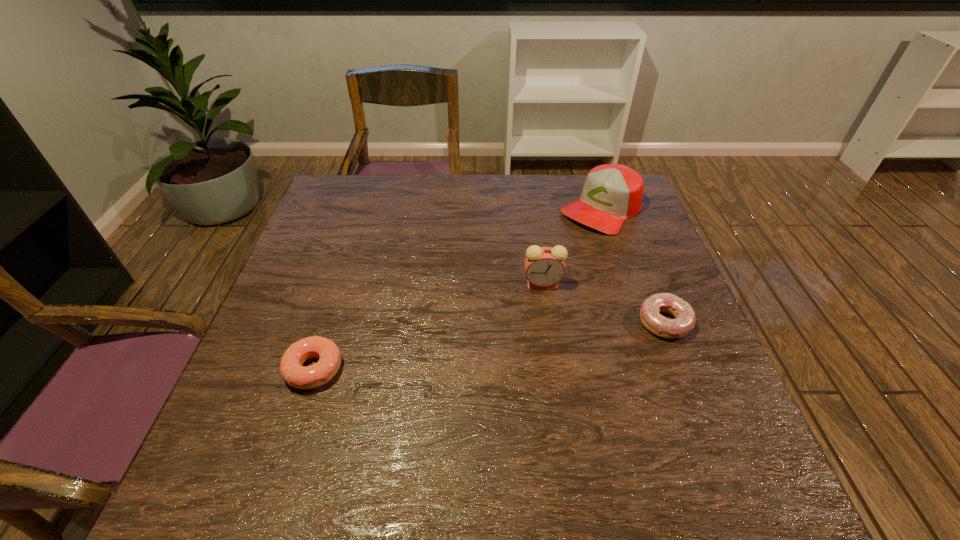
Find the location of a particular element. The width and height of the screenshot is (960, 540). vacant space located 0.060m on the face of the third nearest object is located at coordinates (516, 303).

Locate an element on the screen. This screenshot has width=960, height=540. free space located 0.400m on the face of the third nearest object is located at coordinates (411, 400).

Image resolution: width=960 pixels, height=540 pixels. In order to click on vacant space located 0.220m on the front-facing side of the farthest object in this screenshot , I will do `click(536, 269)`.

Identify the location of vacant space situated 0.190m on the front-facing side of the farthest object. The width and height of the screenshot is (960, 540). (542, 264).

The height and width of the screenshot is (540, 960). In order to click on free space located 0.300m on the front-facing side of the farthest object in this screenshot , I will do `click(517, 286)`.

The image size is (960, 540). What are the coordinates of `object at the far edge` in the screenshot? It's located at (612, 193).

Find the location of a particular element. Image resolution: width=960 pixels, height=540 pixels. object that is at the left edge is located at coordinates (x=301, y=377).

At what (x,y) coordinates should I click in order to perform the action: click on doughnut at the right edge. Please return your answer as a coordinate pair (x, y). Looking at the image, I should click on (685, 319).

You are a GUI agent. You are given a task and a screenshot of the screen. Output one action in this format:
    pyautogui.click(x=<x>, y=<y>)
    Task: Click on the baseball cap at the right edge
    
    Given the screenshot: What is the action you would take?
    pyautogui.click(x=612, y=193)

Image resolution: width=960 pixels, height=540 pixels. What are the coordinates of `object that is at the far right corner` in the screenshot? It's located at (612, 193).